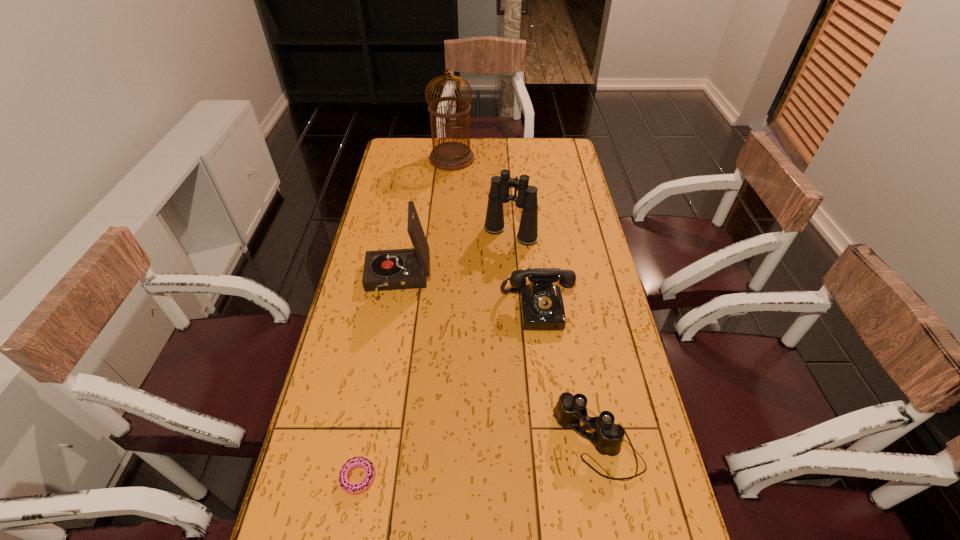
What are the coordinates of `empty space that is in between the shortest object and the shorter binoculars` in the screenshot? It's located at (478, 460).

The width and height of the screenshot is (960, 540). Identify the location of free space that is in between the nearer binoculars and the telephone. coord(567,376).

Locate an element on the screen. free space that is in between the phonograph record and the doughnut is located at coordinates (378, 379).

At what (x,y) coordinates should I click in order to perform the action: click on free area in between the fifth nearest object and the shortest object. Please return your answer as a coordinate pair (x, y). This screenshot has height=540, width=960. Looking at the image, I should click on (435, 355).

Identify which object is the closest to the birdcage. Please provide its 2D coordinates. Your answer should be formatted as a tuple, i.e. [(x, y)], where the tuple contains the x and y coordinates of a point satisfying the conditions above.

[(527, 234)]

Point out which object is positioned as the second nearest to the doughnut. Please provide its 2D coordinates. Your answer should be formatted as a tuple, i.e. [(x, y)], where the tuple contains the x and y coordinates of a point satisfying the conditions above.

[(396, 269)]

The height and width of the screenshot is (540, 960). I want to click on vacant space that satisfies the following two spatial constraints: 1. on the front-facing side of the tallest object; 2. on the front side of the phonograph record, so click(x=442, y=280).

At what (x,y) coordinates should I click in order to perform the action: click on free space that satisfies the following two spatial constraints: 1. on the front side of the phonograph record; 2. on the left side of the nearer binoculars. Please return your answer as a coordinate pair (x, y). Looking at the image, I should click on (369, 443).

The image size is (960, 540). I want to click on free space that satisfies the following two spatial constraints: 1. on the dial of the telephone; 2. on the right side of the fifth tallest object, so click(552, 443).